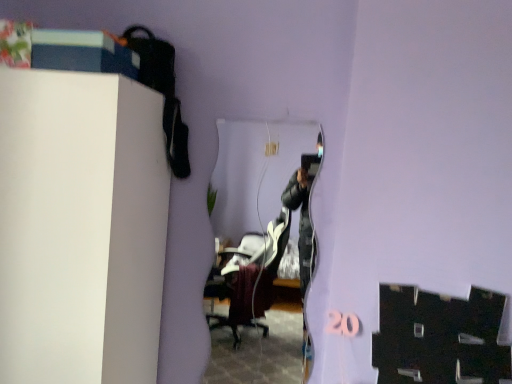
What is the approximate height of white matte cabinet at upper left?

4.16 feet.

This screenshot has height=384, width=512. What are the coordinates of `white matte cabinet at upper left` in the screenshot? It's located at (80, 227).

This screenshot has width=512, height=384. What do you see at coordinates (80, 227) in the screenshot?
I see `white matte cabinet at upper left` at bounding box center [80, 227].

In order to face white matte cabinet at upper left, should I rotate leftwards or rightwards?

You should rotate left by 26.975 degrees.

This screenshot has width=512, height=384. Describe the element at coordinates (256, 248) in the screenshot. I see `clear glass mirror at center` at that location.

The image size is (512, 384). In order to click on clear glass mirror at center in this screenshot , I will do `click(256, 248)`.

Find the location of a particular element. This screenshot has height=384, width=512. white matte cabinet at upper left is located at coordinates (80, 227).

Considering the positions of objects white matte cabinet at upper left and clear glass mirror at center in the image provided, who is more to the right, white matte cabinet at upper left or clear glass mirror at center?

From the viewer's perspective, clear glass mirror at center appears more on the right side.

Is white matte cabinet at upper left in front of or behind clear glass mirror at center in the image?

In the image, white matte cabinet at upper left appears in front of clear glass mirror at center.

Is point (5, 330) closer or farther from the camera than point (269, 382)?

Point (5, 330) is positioned closer to the camera compared to point (269, 382).

Consider the image. From the image's perspective, which object appears higher, white matte cabinet at upper left or clear glass mirror at center?

white matte cabinet at upper left.

In the scene shown: From a real-world perspective, is white matte cabinet at upper left above or below clear glass mirror at center?

white matte cabinet at upper left is below clear glass mirror at center.

Does white matte cabinet at upper left have a lesser width compared to clear glass mirror at center?

No, white matte cabinet at upper left is not thinner than clear glass mirror at center.

Considering the relative sizes of white matte cabinet at upper left and clear glass mirror at center in the image provided, is white matte cabinet at upper left shorter than clear glass mirror at center?

In fact, white matte cabinet at upper left may be taller than clear glass mirror at center.

Considering the sizes of objects white matte cabinet at upper left and clear glass mirror at center in the image provided, who is bigger, white matte cabinet at upper left or clear glass mirror at center?

With larger size is white matte cabinet at upper left.

Is white matte cabinet at upper left situated inside clear glass mirror at center or outside?

white matte cabinet at upper left cannot be found inside clear glass mirror at center.

In the scene shown: Is white matte cabinet at upper left next to clear glass mirror at center and touching it?

white matte cabinet at upper left and clear glass mirror at center are clearly separated.

Is clear glass mirror at center at the back of white matte cabinet at upper left?

No, white matte cabinet at upper left's orientation is not away from clear glass mirror at center.

What's the angular difference between white matte cabinet at upper left and clear glass mirror at center's facing directions?

The angle between the facing direction of white matte cabinet at upper left and the facing direction of clear glass mirror at center is 1.34 degrees.

The image size is (512, 384). Identify the location of furniture that appears below the clear glass mirror at center (from a real-world perspective). (80, 227).

Which is more to the right, clear glass mirror at center or white matte cabinet at upper left?

clear glass mirror at center is more to the right.

Relative to white matte cabinet at upper left, is clear glass mirror at center in front or behind?

Clearly, clear glass mirror at center is behind white matte cabinet at upper left.

Which is more distant, (284, 273) or (131, 150)?

The point (284, 273) is behind.

From the image's perspective, between clear glass mirror at center and white matte cabinet at upper left, who is located below?

From the image's view, clear glass mirror at center is below.

From a real-world perspective, who is located higher, clear glass mirror at center or white matte cabinet at upper left?

From a 3D spatial view, clear glass mirror at center is above.

Looking at their sizes, would you say clear glass mirror at center is wider or thinner than white matte cabinet at upper left?

In the image, clear glass mirror at center appears to be more narrow than white matte cabinet at upper left.

From their relative heights in the image, would you say clear glass mirror at center is taller or shorter than white matte cabinet at upper left?

clear glass mirror at center is shorter than white matte cabinet at upper left.

Can you confirm if clear glass mirror at center is bigger than white matte cabinet at upper left?

Actually, clear glass mirror at center might be smaller than white matte cabinet at upper left.

Would you say white matte cabinet at upper left is part of clear glass mirror at center's contents?

That's incorrect, white matte cabinet at upper left is not inside clear glass mirror at center.

Are clear glass mirror at center and white matte cabinet at upper left far apart?

That's right, there is a large distance between clear glass mirror at center and white matte cabinet at upper left.

Is clear glass mirror at center aimed at white matte cabinet at upper left?

No, clear glass mirror at center is not turned towards white matte cabinet at upper left.

Locate an element on the screen. furniture in front of the clear glass mirror at center is located at coordinates (80, 227).

Identify the location of mirror above the white matte cabinet at upper left (from a real-world perspective). 256,248.

The width and height of the screenshot is (512, 384). In the image, there is a white matte cabinet at upper left. Find the location of `mirror below it (from the image's perspective)`. mirror below it (from the image's perspective) is located at coordinates (256, 248).